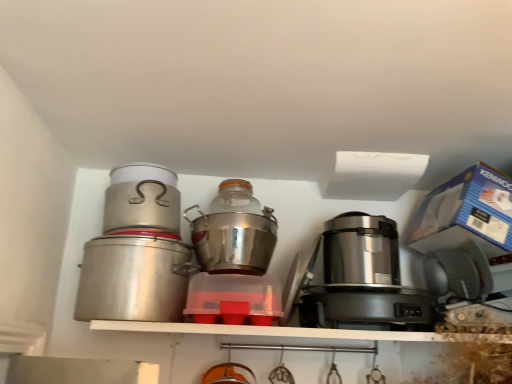
Question: From a real-world perspective, is brushed metal canister at left, marked as the first kitchen appliance in a left-to-right arrangement, physically below brushed metal canister at left, placed as the third kitchen appliance when sorted from right to left?

Choices:
 (A) yes
 (B) no

Answer: (A)

Question: From a real-world perspective, is brushed metal canister at left, the 4th kitchen appliance positioned from the right, positioned over brushed metal canister at left, which is the second kitchen appliance from left to right, based on gravity?

Choices:
 (A) no
 (B) yes

Answer: (A)

Question: Considering the relative sizes of brushed metal canister at left, the 4th kitchen appliance positioned from the right, and brushed metal canister at left, placed as the third kitchen appliance when sorted from right to left, in the image provided, is brushed metal canister at left, the 4th kitchen appliance positioned from the right, taller than brushed metal canister at left, placed as the third kitchen appliance when sorted from right to left,?

Choices:
 (A) no
 (B) yes

Answer: (B)

Question: Is brushed metal canister at left, the 4th kitchen appliance positioned from the right, facing towards brushed metal canister at left, which is the second kitchen appliance from left to right?

Choices:
 (A) no
 (B) yes

Answer: (A)

Question: Would you say brushed metal canister at left, which is the second kitchen appliance from left to right, is part of brushed metal canister at left, marked as the first kitchen appliance in a left-to-right arrangement,'s contents?

Choices:
 (A) yes
 (B) no

Answer: (B)

Question: Is brushed metal canister at left, the 4th kitchen appliance positioned from the right, positioned behind brushed metal canister at left, which is the second kitchen appliance from left to right?

Choices:
 (A) no
 (B) yes

Answer: (A)

Question: From a real-world perspective, is satin metallic rice cooker at center, which ranks as the 2th appliance in bottom-to-top order, located higher than satin silver appliance at right, the second appliance in the top-to-bottom sequence?

Choices:
 (A) yes
 (B) no

Answer: (A)

Question: Could you tell me if satin metallic rice cooker at center, which ranks as the 2th appliance in bottom-to-top order, is facing satin silver appliance at right, the first appliance positioned from the bottom?

Choices:
 (A) no
 (B) yes

Answer: (A)

Question: Is satin metallic rice cooker at center, which ranks as the 2th appliance in bottom-to-top order, surrounding satin silver appliance at right, the second appliance in the top-to-bottom sequence?

Choices:
 (A) no
 (B) yes

Answer: (A)

Question: Is satin metallic rice cooker at center, placed as the 1th appliance when sorted from top to bottom, positioned with its back to satin silver appliance at right, the second appliance in the top-to-bottom sequence?

Choices:
 (A) yes
 (B) no

Answer: (B)

Question: Is satin metallic rice cooker at center, which ranks as the 2th appliance in bottom-to-top order, thinner than satin silver appliance at right, the second appliance in the top-to-bottom sequence?

Choices:
 (A) yes
 (B) no

Answer: (B)

Question: Is satin metallic rice cooker at center, which ranks as the 2th appliance in bottom-to-top order, further to camera compared to satin silver appliance at right, the first appliance positioned from the bottom?

Choices:
 (A) yes
 (B) no

Answer: (A)

Question: Is shiny metallic pot at center, which is the 1th kitchen appliance in right-to-left order, taller than brushed metal canister at left, which is the second kitchen appliance from left to right?

Choices:
 (A) yes
 (B) no

Answer: (A)